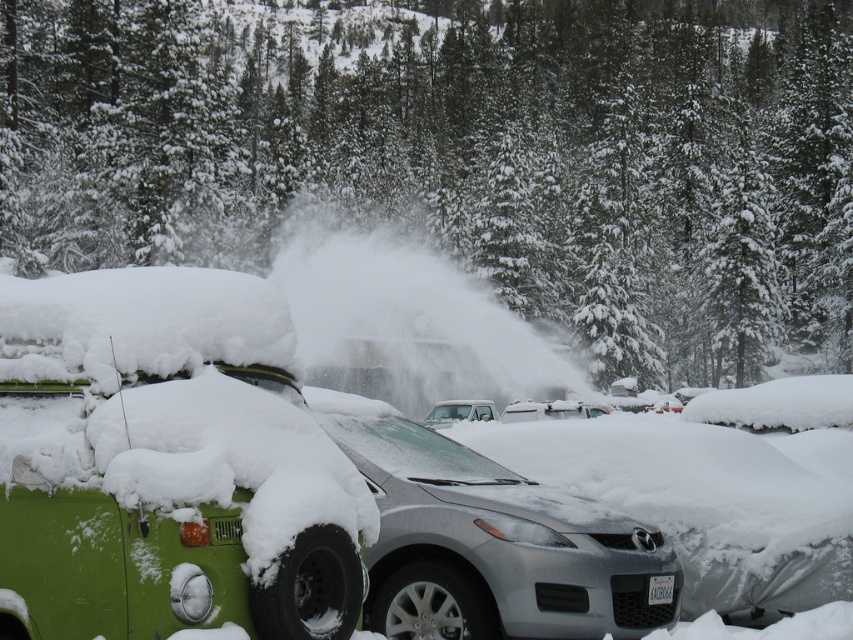
From the picture: You are standing at the origin point in the snowy forest scene. You see two points marked in the image. Which point is closer to you, point (207, 496) or point (477, 400)?

Point (207, 496) is in front of point (477, 400), so it is closer to you.

You are a delivery driver who needs to access the white plastic license plate at center to read its number. The green matte van at left is blocking your path. Can you move around the van to reach the license plate?

The green matte van at left is to the left of white plastic license plate at center, so you can move around the van to the right side to access the license plate.

You are a delivery driver who needs to deliver a package to a house located behind the white matte truck at center and the white plastic license plate at center. Which object should you move first to access the house?

The white matte truck at center is larger in size than the white plastic license plate at center, so you should move the white matte truck at center first to access the house.